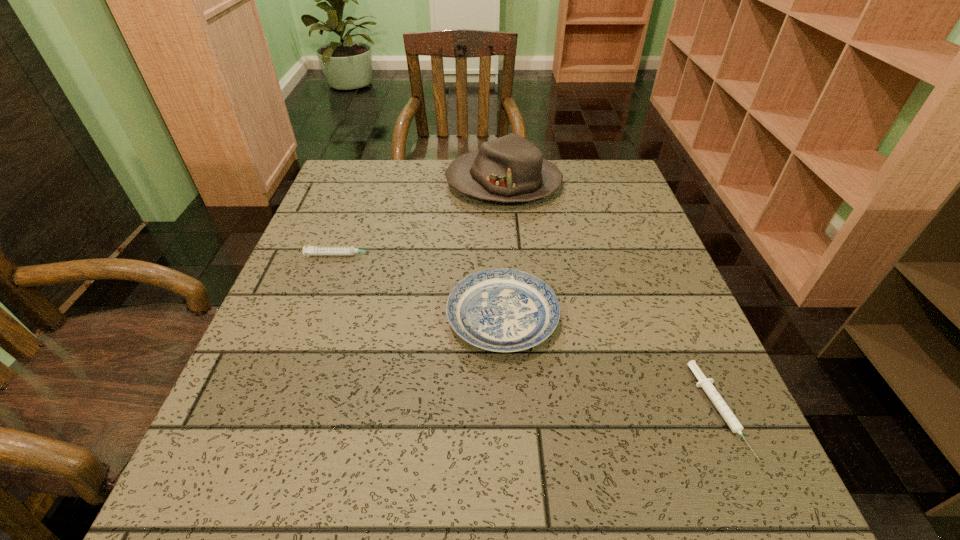
Where is `vacant region between the second farthest object and the farthest object`? Image resolution: width=960 pixels, height=540 pixels. vacant region between the second farthest object and the farthest object is located at coordinates (423, 219).

Where is `vacant area that lies between the farthest object and the plate`? This screenshot has height=540, width=960. vacant area that lies between the farthest object and the plate is located at coordinates (503, 251).

In order to click on vacant space in between the nearer syringe and the second tallest object in this screenshot , I will do `click(610, 363)`.

Where is `free spot between the third farthest object and the shorter syringe`? The width and height of the screenshot is (960, 540). free spot between the third farthest object and the shorter syringe is located at coordinates (610, 363).

At what (x,y) coordinates should I click in order to perform the action: click on free space that is in between the tallest object and the plate. Please return your answer as a coordinate pair (x, y). The image size is (960, 540). Looking at the image, I should click on (x=503, y=251).

The height and width of the screenshot is (540, 960). I want to click on object that can be found as the closest to the tallest object, so click(309, 250).

Identify the location of object that is the third closest to the tallest object. (706, 384).

In order to click on vacant space that satisfies the following two spatial constraints: 1. on the decorative side of the hat; 2. on the right side of the rightmost object in this screenshot , I will do `click(520, 410)`.

The image size is (960, 540). In order to click on vacant region that satisfies the following two spatial constraints: 1. on the decorative side of the farthest object; 2. on the right side of the nearer syringe in this screenshot , I will do `click(520, 410)`.

I want to click on blank space that satisfies the following two spatial constraints: 1. on the decorative side of the nearer syringe; 2. on the right side of the farthest object, so click(520, 410).